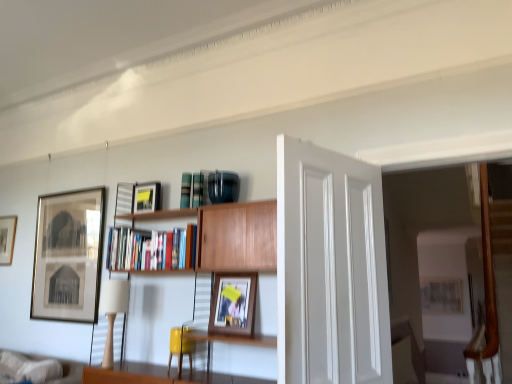
Describe the element at coordinates (151, 249) in the screenshot. I see `wooden bookshelf at center` at that location.

This screenshot has height=384, width=512. What do you see at coordinates (330, 269) in the screenshot? I see `white smooth door at center` at bounding box center [330, 269].

Find the location of `matte black picture frame at left, marked as the first picture frame in a left-to-right arrangement`. matte black picture frame at left, marked as the first picture frame in a left-to-right arrangement is located at coordinates coord(7,239).

Where is `beige fabric lampshade at left`? This screenshot has height=384, width=512. beige fabric lampshade at left is located at coordinates (112, 312).

Describe the element at coordinates (147, 197) in the screenshot. The height and width of the screenshot is (384, 512). I see `matte black picture frame at upper center, which is counted as the 2th picture frame, starting from the right` at that location.

What is the approximate width of matte black picture frame at upper center, marked as the third picture frame in a left-to-right arrangement?

matte black picture frame at upper center, marked as the third picture frame in a left-to-right arrangement, is 3.54 inches in width.

The width and height of the screenshot is (512, 384). I want to click on wooden bookshelf at center, so click(151, 249).

Is matte black picture frame at left, marked as the second picture frame in a left-to-right arrangement, not near matte black picture frame at upper center, the second picture frame from the front?

No.

Considering the sizes of objects matte black picture frame at left, marked as the 3th picture frame in a front-to-back arrangement, and matte black picture frame at upper center, marked as the third picture frame in a left-to-right arrangement, in the image provided, who is smaller, matte black picture frame at left, marked as the 3th picture frame in a front-to-back arrangement, or matte black picture frame at upper center, marked as the third picture frame in a left-to-right arrangement,?

matte black picture frame at upper center, marked as the third picture frame in a left-to-right arrangement.

Does matte black picture frame at left, marked as the 3th picture frame in a front-to-back arrangement, have a greater width compared to matte black picture frame at upper center, which is counted as the 2th picture frame, starting from the right?

No, matte black picture frame at left, marked as the 3th picture frame in a front-to-back arrangement, is not wider than matte black picture frame at upper center, which is counted as the 2th picture frame, starting from the right.

Based on their positions, is matte black picture frame at left, marked as the second picture frame in a left-to-right arrangement, located to the left or right of matte black picture frame at upper center, which is the 3th picture frame from back to front?

matte black picture frame at left, marked as the second picture frame in a left-to-right arrangement, is positioned on matte black picture frame at upper center, which is the 3th picture frame from back to front,'s left side.

In the image, is matte black picture frame at upper center, the second picture frame from the front, positioned in front of or behind wooden framed photo at center, the 1th picture frame from the front?

matte black picture frame at upper center, the second picture frame from the front, is positioned farther from the viewer than wooden framed photo at center, the 1th picture frame from the front.

From a real-world perspective, is matte black picture frame at upper center, which is the 3th picture frame from back to front, above or below wooden framed photo at center, the 1th picture frame from the front?

Clearly, from a real-world perspective, matte black picture frame at upper center, which is the 3th picture frame from back to front, is above wooden framed photo at center, the 1th picture frame from the front.

Looking at this image, in terms of height, does matte black picture frame at upper center, which is the 3th picture frame from back to front, look taller or shorter compared to wooden framed photo at center, positioned as the first picture frame in right-to-left order?

Clearly, matte black picture frame at upper center, which is the 3th picture frame from back to front, is shorter compared to wooden framed photo at center, positioned as the first picture frame in right-to-left order.

Is matte black picture frame at upper center, marked as the third picture frame in a left-to-right arrangement, beside wooden framed photo at center, positioned as the 4th picture frame in back-to-front order?

No, matte black picture frame at upper center, marked as the third picture frame in a left-to-right arrangement, is not next to wooden framed photo at center, positioned as the 4th picture frame in back-to-front order.

From the image's perspective, between wooden bookcase at center and wooden bookshelf at center, which one is located above?

wooden bookshelf at center is shown above in the image.

Does point (253, 236) come closer to viewer compared to point (184, 254)?

That is True.

Is wooden bookcase at center taller or shorter than wooden bookshelf at center?

wooden bookcase at center is taller than wooden bookshelf at center.

Which object is closer to the camera taking this photo, matte black picture frame at left, which appears as the first picture frame when viewed from the back, or matte black picture frame at left, marked as the second picture frame in a left-to-right arrangement?

matte black picture frame at left, marked as the second picture frame in a left-to-right arrangement, is more forward.

Is matte black picture frame at left, marked as the first picture frame in a left-to-right arrangement, bigger than matte black picture frame at left, marked as the 3th picture frame in a front-to-back arrangement?

No, matte black picture frame at left, marked as the first picture frame in a left-to-right arrangement, is not bigger than matte black picture frame at left, marked as the 3th picture frame in a front-to-back arrangement.

From the image's perspective, is matte black picture frame at left, marked as the first picture frame in a left-to-right arrangement, located above matte black picture frame at left, marked as the 3th picture frame in a front-to-back arrangement?

Yes.

Is matte black picture frame at left, arranged as the 4th picture frame when viewed from the front, looking in the opposite direction of matte black picture frame at left, the 2th picture frame positioned from the back?

No, matte black picture frame at left, arranged as the 4th picture frame when viewed from the front,'s orientation is not away from matte black picture frame at left, the 2th picture frame positioned from the back.

Considering the sizes of objects white smooth door at center and matte black picture frame at left, which appears as the 4th picture frame when viewed from the right, in the image provided, who is thinner, white smooth door at center or matte black picture frame at left, which appears as the 4th picture frame when viewed from the right,?

With smaller width is matte black picture frame at left, which appears as the 4th picture frame when viewed from the right.

Which object is positioned more to the right, white smooth door at center or matte black picture frame at left, arranged as the 4th picture frame when viewed from the front?

Positioned to the right is white smooth door at center.

From the image's perspective, between white smooth door at center and matte black picture frame at left, which appears as the first picture frame when viewed from the back, who is located below?

matte black picture frame at left, which appears as the first picture frame when viewed from the back, from the image's perspective.

Which of these two, white smooth door at center or matte black picture frame at left, marked as the first picture frame in a left-to-right arrangement, is bigger?

With larger size is white smooth door at center.

From a real-world perspective, between white smooth door at center and wooden bookcase at center, who is vertically lower?

wooden bookcase at center is physically lower.

From the image's perspective, is white smooth door at center positioned above or below wooden bookcase at center?

From the image's perspective, white smooth door at center appears above wooden bookcase at center.

Based on their sizes in the image, would you say white smooth door at center is bigger or smaller than wooden bookcase at center?

Clearly, white smooth door at center is smaller in size than wooden bookcase at center.

From their relative heights in the image, would you say wooden bookcase at center is taller or shorter than matte black picture frame at upper center, which is the 3th picture frame from back to front?

Considering their sizes, wooden bookcase at center has more height than matte black picture frame at upper center, which is the 3th picture frame from back to front.

How many degrees apart are the facing directions of wooden bookcase at center and matte black picture frame at upper center, which is the 3th picture frame from back to front?

The angle between the facing direction of wooden bookcase at center and the facing direction of matte black picture frame at upper center, which is the 3th picture frame from back to front, is 1.15 degrees.

Is wooden bookcase at center to the right of matte black picture frame at upper center, which is counted as the 2th picture frame, starting from the right, from the viewer's perspective?

Indeed, wooden bookcase at center is positioned on the right side of matte black picture frame at upper center, which is counted as the 2th picture frame, starting from the right.

Is wooden bookcase at center looking in the opposite direction of matte black picture frame at upper center, which is counted as the 2th picture frame, starting from the right?

No, wooden bookcase at center is not facing the opposite direction of matte black picture frame at upper center, which is counted as the 2th picture frame, starting from the right.

Identify the location of the 1st picture frame in front of the matte black picture frame at left, marked as the 3th picture frame in a front-to-back arrangement, starting your count from the anchor. (147, 197).

Locate an element on the screen. This screenshot has height=384, width=512. the 1st picture frame to the left when counting from the wooden framed photo at center, positioned as the first picture frame in right-to-left order is located at coordinates (147, 197).

When comparing their distances from matte yellow swivel chair at center, does matte black picture frame at left, marked as the 3th picture frame in a front-to-back arrangement, or white smooth door at center seem further?

Based on the image, white smooth door at center appears to be further to matte yellow swivel chair at center.

Looking at the image, which one is located closer to matte yellow swivel chair at center, matte black picture frame at left, arranged as the 4th picture frame when viewed from the front, or wooden framed photo at center, the 1th picture frame from the front?

wooden framed photo at center, the 1th picture frame from the front, is positioned closer to the anchor matte yellow swivel chair at center.

Which object lies nearer to the anchor point wooden bookcase at center, beige fabric lampshade at left or matte yellow swivel chair at center?

matte yellow swivel chair at center is positioned closer to the anchor wooden bookcase at center.

Looking at this image, considering their positions, is matte black picture frame at left, which appears as the 4th picture frame when viewed from the right, positioned closer to matte yellow swivel chair at center than white smooth door at center?

white smooth door at center is positioned closer to the anchor matte yellow swivel chair at center.

Which object lies further to the anchor point wooden framed photo at center, the 1th picture frame from the front, white smooth door at center or matte black picture frame at left, the 2th picture frame positioned from the back?

Among the two, matte black picture frame at left, the 2th picture frame positioned from the back, is located further to wooden framed photo at center, the 1th picture frame from the front.

When comparing their distances from wooden bookcase at center, does wooden bookshelf at center or matte yellow swivel chair at center seem further?

matte yellow swivel chair at center is further to wooden bookcase at center.

Looking at the image, which one is located closer to beige fabric lampshade at left, white smooth door at center or matte black picture frame at upper center, which is counted as the 2th picture frame, starting from the right?

Among the two, matte black picture frame at upper center, which is counted as the 2th picture frame, starting from the right, is located nearer to beige fabric lampshade at left.

Looking at the image, which one is located closer to wooden bookcase at center, white smooth door at center or beige fabric lampshade at left?

Among the two, white smooth door at center is located nearer to wooden bookcase at center.

Find the location of a particular element. The image size is (512, 384). lamp between matte black picture frame at left, which appears as the first picture frame when viewed from the back, and matte yellow swivel chair at center is located at coordinates (112, 312).

Identify the location of picture frame located between wooden bookcase at center and matte yellow swivel chair at center in the depth direction. This screenshot has width=512, height=384. (233, 304).

Find the location of a particular element. shelf located between matte black picture frame at left, the third picture frame from the right, and white smooth door at center in the left-right direction is located at coordinates (151, 249).

This screenshot has height=384, width=512. In order to click on picture frame situated between matte black picture frame at left, marked as the second picture frame in a left-to-right arrangement, and wooden framed photo at center, positioned as the 4th picture frame in back-to-front order, from left to right in this screenshot , I will do `click(147, 197)`.